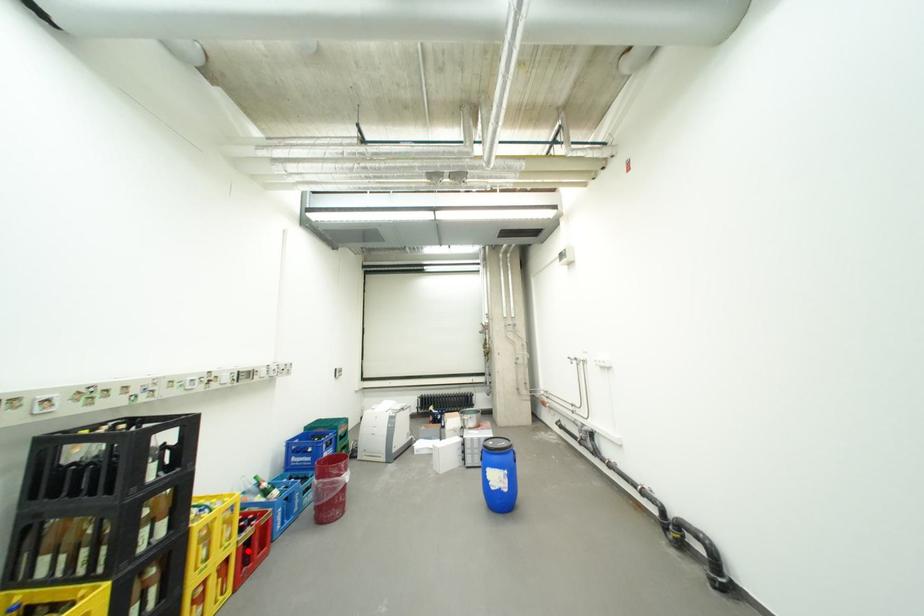
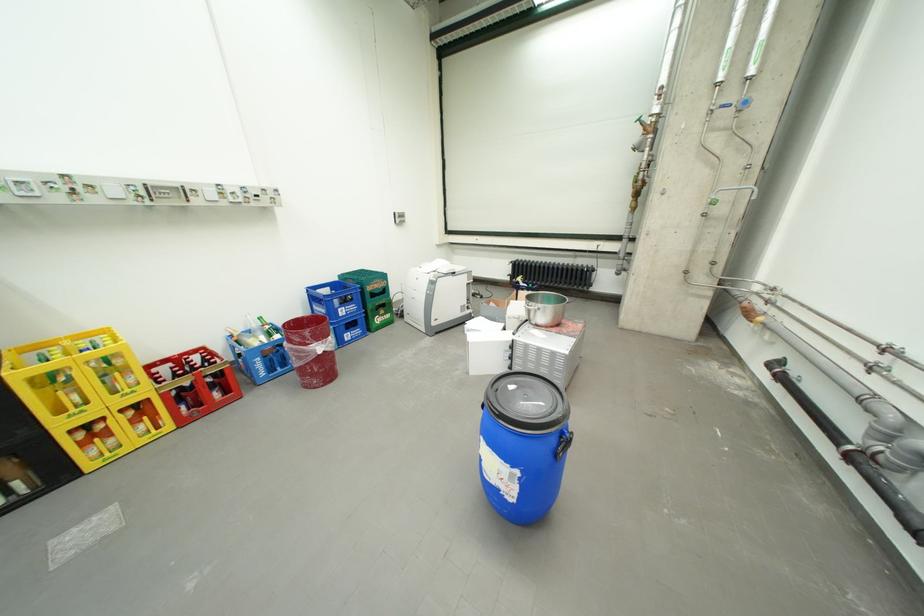
In the second image, find the point that corresponds to the highlighted location in the first image.

(172, 397)